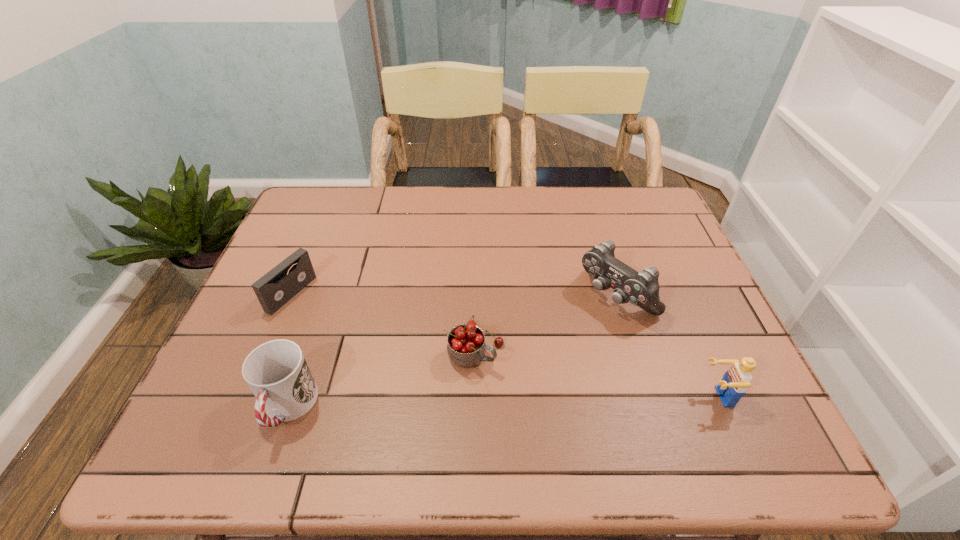
This screenshot has width=960, height=540. Find the location of `vacant region between the videotape and the second object from right to left`. vacant region between the videotape and the second object from right to left is located at coordinates (454, 295).

You are a GUI agent. You are given a task and a screenshot of the screen. Output one action in this format:
    pyautogui.click(x=<x>, y=<y>)
    Task: Click on the empty location between the third object from left to right and the control
    The height and width of the screenshot is (540, 960).
    Given the screenshot: What is the action you would take?
    pyautogui.click(x=545, y=323)

The width and height of the screenshot is (960, 540). Find the location of `free space between the control and the shortest object`. free space between the control and the shortest object is located at coordinates (454, 295).

Image resolution: width=960 pixels, height=540 pixels. Identify the location of free space between the videotape and the fourth object from left to right. (454, 295).

I want to click on vacant area between the control and the Lego, so click(x=666, y=346).

Where is `unoccupied position between the rightmost object and the control`? This screenshot has height=540, width=960. unoccupied position between the rightmost object and the control is located at coordinates (666, 346).

Locate an element on the screen. The width and height of the screenshot is (960, 540). vacant area that lies between the rightmost object and the second object from right to left is located at coordinates (666, 346).

This screenshot has width=960, height=540. What are the coordinates of `vacant area that lies between the second object from right to left and the third object from left to right` in the screenshot? It's located at (545, 323).

Where is `vacant space in between the cup and the rightmost object`? vacant space in between the cup and the rightmost object is located at coordinates (502, 402).

Select which object appears as the fourth closest to the pot filled with cherries. Please provide its 2D coordinates. Your answer should be formatted as a tuple, i.e. [(x, y)], where the tuple contains the x and y coordinates of a point satisfying the conditions above.

[(737, 379)]